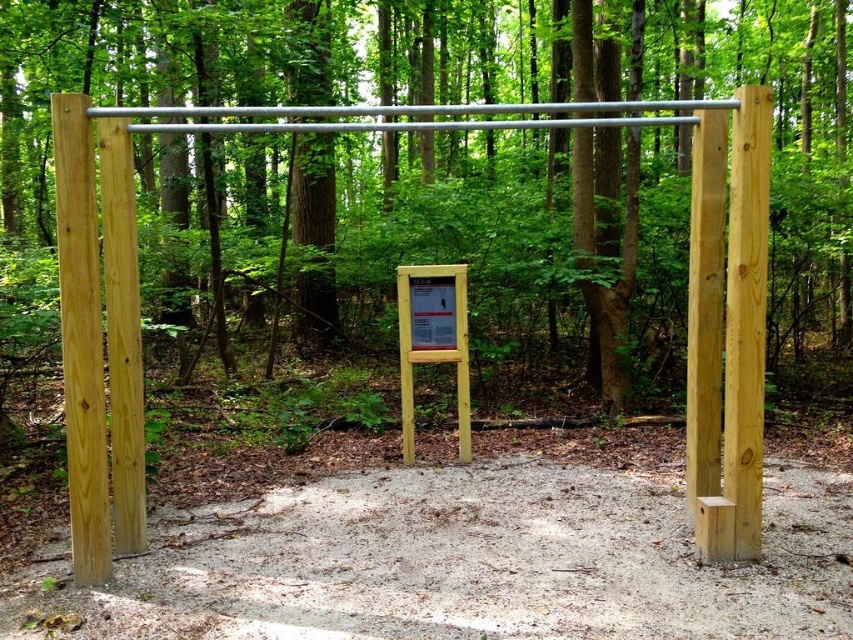
Between point (70, 104) and point (405, 440), which one is positioned in front?

Point (70, 104) is in front.

This screenshot has height=640, width=853. Find the location of `natural light wood post at left`. natural light wood post at left is located at coordinates (80, 339).

Can you confirm if natural wood sign at center is positioned above wooden sign at center?

Indeed, natural wood sign at center is positioned over wooden sign at center.

Is natural wood sign at center to the right of wooden sign at center from the viewer's perspective?

Correct, you'll find natural wood sign at center to the right of wooden sign at center.

The height and width of the screenshot is (640, 853). What do you see at coordinates (453, 228) in the screenshot?
I see `natural wood sign at center` at bounding box center [453, 228].

Locate an element on the screen. This screenshot has width=853, height=640. natural wood sign at center is located at coordinates (453, 228).

The width and height of the screenshot is (853, 640). What do you see at coordinates (453, 228) in the screenshot? I see `natural wood sign at center` at bounding box center [453, 228].

Can you confirm if natural wood sign at center is positioned below yellow wood sign at center?

Actually, natural wood sign at center is above yellow wood sign at center.

Identify the location of natural wood sign at center. This screenshot has width=853, height=640. [453, 228].

Where is `natural wood sign at center`? natural wood sign at center is located at coordinates (453, 228).